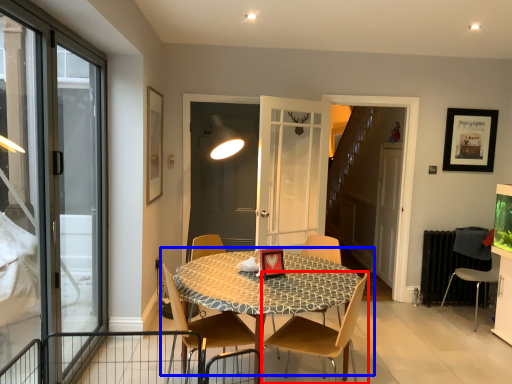
Question: Which point is closer to the camera, chair (highlighted by a red box) or kitchen & dining room table (highlighted by a blue box)?

Choices:
 (A) chair
 (B) kitchen & dining room table

Answer: (A)